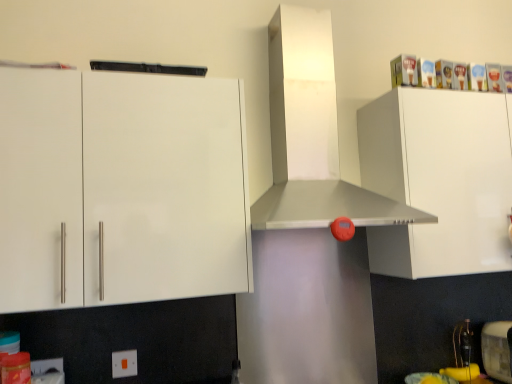
Question: Could you tell me if white glossy cabinet at upper right, which ranks as the 2th cabinetry in left-to-right order, is facing metallic silver toaster at lower right?

Choices:
 (A) yes
 (B) no

Answer: (B)

Question: Is white glossy cabinet at upper right, which ranks as the 2th cabinetry in left-to-right order, taller than metallic silver toaster at lower right?

Choices:
 (A) yes
 (B) no

Answer: (A)

Question: Could metallic silver toaster at lower right be considered to be inside white glossy cabinet at upper right, which ranks as the 2th cabinetry in left-to-right order?

Choices:
 (A) yes
 (B) no

Answer: (B)

Question: Can you confirm if white glossy cabinet at upper right, which ranks as the 2th cabinetry in left-to-right order, is smaller than metallic silver toaster at lower right?

Choices:
 (A) no
 (B) yes

Answer: (A)

Question: From a real-world perspective, is white glossy cabinet at upper right, which is counted as the first cabinetry, starting from the right, physically below metallic silver toaster at lower right?

Choices:
 (A) no
 (B) yes

Answer: (A)

Question: Looking at their shapes, would you say white plastic electric outlet at lower left, the 1th electric outlet from the front, is wider or thinner than white plastic electric outlet at lower center, which is the 1th electric outlet in back-to-front order?

Choices:
 (A) wide
 (B) thin

Answer: (B)

Question: Considering the positions of white plastic electric outlet at lower left, the 1th electric outlet from the front, and white plastic electric outlet at lower center, the first electric outlet in the right-to-left sequence, in the image, is white plastic electric outlet at lower left, the 1th electric outlet from the front, taller or shorter than white plastic electric outlet at lower center, the first electric outlet in the right-to-left sequence,?

Choices:
 (A) tall
 (B) short

Answer: (A)

Question: Would you say white plastic electric outlet at lower left, the first electric outlet positioned from the left, is inside or outside white plastic electric outlet at lower center, acting as the second electric outlet starting from the left?

Choices:
 (A) outside
 (B) inside

Answer: (A)

Question: From the image's perspective, is white plastic electric outlet at lower left, the first electric outlet positioned from the left, positioned above or below white plastic electric outlet at lower center, which is the 1th electric outlet in back-to-front order?

Choices:
 (A) below
 (B) above

Answer: (A)

Question: In terms of width, does metallic silver range hood at center look wider or thinner when compared to metallic silver toaster at lower right?

Choices:
 (A) wide
 (B) thin

Answer: (A)

Question: From a real-world perspective, is metallic silver range hood at center above or below metallic silver toaster at lower right?

Choices:
 (A) above
 (B) below

Answer: (A)

Question: Considering the relative positions of metallic silver range hood at center and metallic silver toaster at lower right in the image provided, is metallic silver range hood at center to the left or to the right of metallic silver toaster at lower right?

Choices:
 (A) left
 (B) right

Answer: (A)

Question: Is metallic silver range hood at center taller or shorter than metallic silver toaster at lower right?

Choices:
 (A) tall
 (B) short

Answer: (A)

Question: Which is correct: white glossy cabinet at upper right, which ranks as the 2th cabinetry in left-to-right order, is inside metallic silver toaster at lower right, or outside of it?

Choices:
 (A) outside
 (B) inside

Answer: (A)

Question: Is white glossy cabinet at upper right, which is counted as the first cabinetry, starting from the right, bigger or smaller than metallic silver toaster at lower right?

Choices:
 (A) big
 (B) small

Answer: (A)